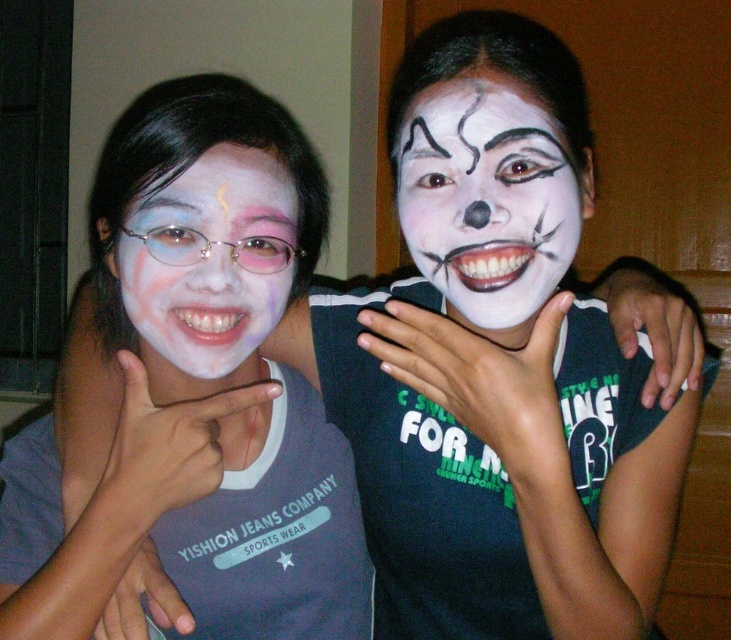
You are a photographer trying to capture a group photo of the two people in the image. You want to ensure that the person with the white matte face paint at center and the matte white face at left are both clearly visible in the frame. Which person should you position closer to the camera to avoid them being blocked by the other?

The white matte face paint at center should be positioned closer to the camera because it is on the right side of the matte white face at left, so moving it forward will prevent blocking.

You are a photographer trying to capture the best shot of the two people in the image. You want to ensure that both the white matte face paint at center and the matte white face at left are clearly visible in your photo. Based on their positions, which one is located higher up in the frame?

The white matte face paint at center is above matte white face at left, so the white matte face paint at center is higher up in the frame.